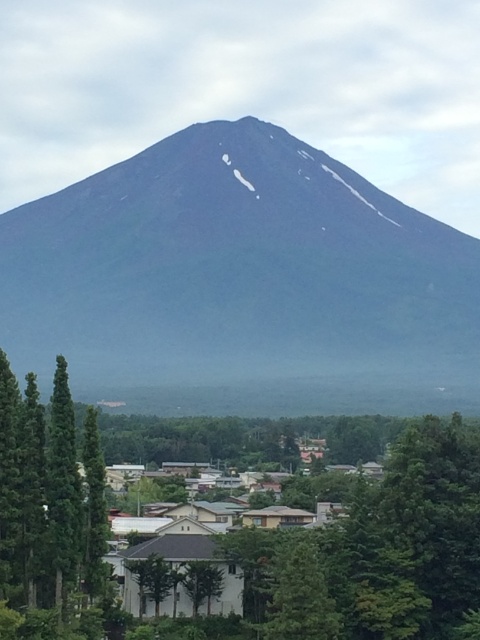
Does dark gray rock mountain at center have a larger size compared to green matte tree at lower left?

Yes, dark gray rock mountain at center is bigger than green matte tree at lower left.

This screenshot has width=480, height=640. Describe the element at coordinates (241, 280) in the screenshot. I see `dark gray rock mountain at center` at that location.

Describe the element at coordinates (241, 280) in the screenshot. I see `dark gray rock mountain at center` at that location.

This screenshot has width=480, height=640. Find the location of `dark gray rock mountain at center`. dark gray rock mountain at center is located at coordinates (241, 280).